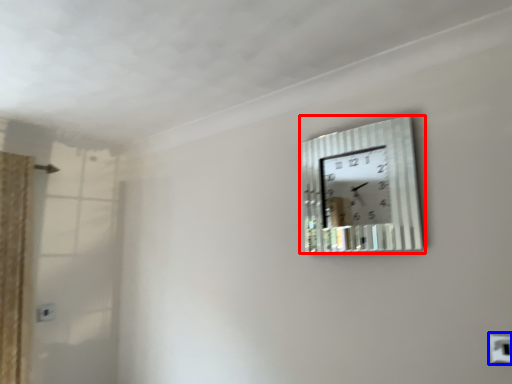
Question: Which object is further to the camera taking this photo, wall clock (highlighted by a red box) or electric outlet (highlighted by a blue box)?

Choices:
 (A) wall clock
 (B) electric outlet

Answer: (A)